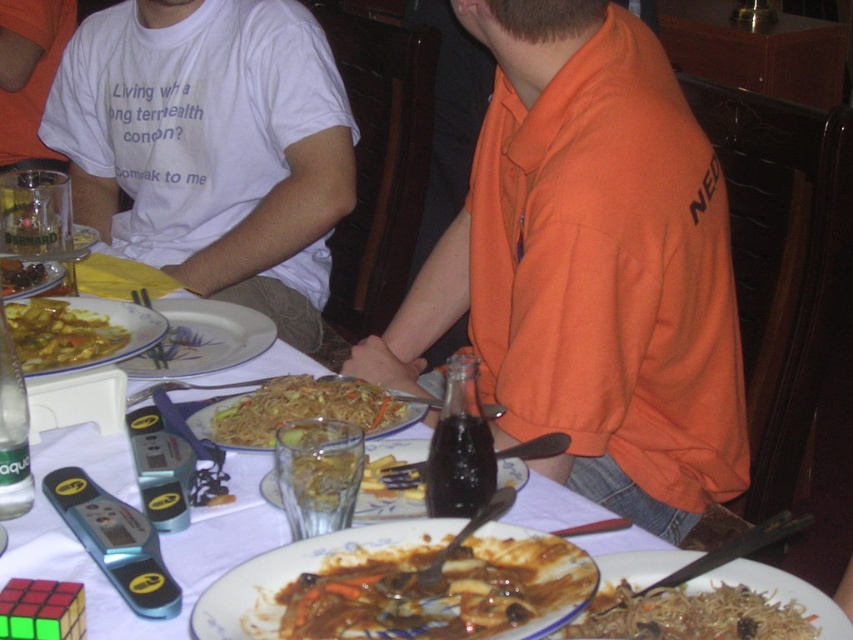
Does point (523, 624) come behind point (192, 374)?

No.

Between brown glossy meat at center and porcelain plate at center, which one is positioned lower?

brown glossy meat at center is below.

I want to click on brown glossy meat at center, so click(434, 589).

The height and width of the screenshot is (640, 853). Identify the location of brown glossy meat at center. (434, 589).

Is point (213, 144) positioned after point (624, 618)?

Yes.

Who is more forward, (241, 200) or (787, 625)?

Point (787, 625)

At what (x,y) coordinates should I click in order to perform the action: click on white cotton shirt at upper left. Please return your answer as a coordinate pair (x, y). The width and height of the screenshot is (853, 640). Looking at the image, I should click on (212, 147).

Which is more to the right, orange cotton shirt at center or yellowish glossy noodles at center?

orange cotton shirt at center is more to the right.

Is orange cotton shirt at center thinner than yellowish glossy noodles at center?

Incorrect, orange cotton shirt at center's width is not less than yellowish glossy noodles at center's.

Find the location of a particular element. orange cotton shirt at center is located at coordinates (589, 268).